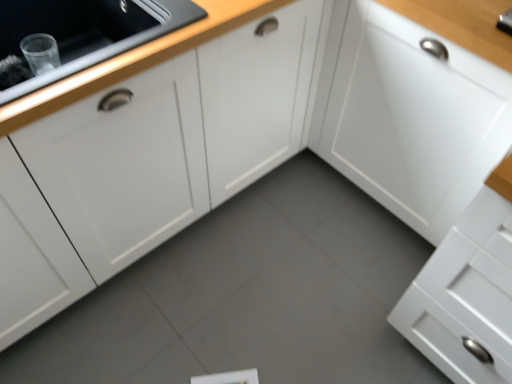
Question: Is white matte cabinet at left, the 2th cabinetry viewed from the right, to the left of white matte cabinet at upper right, which ranks as the first cabinetry in right-to-left order, from the viewer's perspective?

Choices:
 (A) yes
 (B) no

Answer: (A)

Question: Can you confirm if white matte cabinet at left, the 2th cabinetry viewed from the right, is shorter than white matte cabinet at upper right, the second cabinetry in the left-to-right sequence?

Choices:
 (A) yes
 (B) no

Answer: (A)

Question: Is white matte cabinet at left, which is the first cabinetry in left-to-right order, directly adjacent to white matte cabinet at upper right, which ranks as the first cabinetry in right-to-left order?

Choices:
 (A) no
 (B) yes

Answer: (A)

Question: Is the position of white matte cabinet at left, which is the first cabinetry in left-to-right order, more distant than that of white matte cabinet at upper right, which ranks as the first cabinetry in right-to-left order?

Choices:
 (A) no
 (B) yes

Answer: (A)

Question: Considering the relative sizes of white matte cabinet at left, the 2th cabinetry viewed from the right, and white matte cabinet at upper right, the second cabinetry in the left-to-right sequence, in the image provided, is white matte cabinet at left, the 2th cabinetry viewed from the right, smaller than white matte cabinet at upper right, the second cabinetry in the left-to-right sequence,?

Choices:
 (A) yes
 (B) no

Answer: (A)

Question: From the image's perspective, does white matte cabinet at left, the 2th cabinetry viewed from the right, appear higher than white matte cabinet at upper right, the second cabinetry in the left-to-right sequence?

Choices:
 (A) no
 (B) yes

Answer: (B)

Question: From a real-world perspective, does white matte cabinet at upper right, the second cabinetry in the left-to-right sequence, sit lower than white matte cabinet at left, the 2th cabinetry viewed from the right?

Choices:
 (A) no
 (B) yes

Answer: (B)

Question: Would you consider white matte cabinet at upper right, the second cabinetry in the left-to-right sequence, to be distant from white matte cabinet at left, which is the first cabinetry in left-to-right order?

Choices:
 (A) yes
 (B) no

Answer: (B)

Question: Is white matte cabinet at upper right, the second cabinetry in the left-to-right sequence, positioned in front of white matte cabinet at left, which is the first cabinetry in left-to-right order?

Choices:
 (A) no
 (B) yes

Answer: (A)

Question: From the image's perspective, does white matte cabinet at upper right, the second cabinetry in the left-to-right sequence, appear higher than white matte cabinet at left, the 2th cabinetry viewed from the right?

Choices:
 (A) no
 (B) yes

Answer: (A)

Question: Is white matte cabinet at upper right, the second cabinetry in the left-to-right sequence, taller than white matte cabinet at left, the 2th cabinetry viewed from the right?

Choices:
 (A) yes
 (B) no

Answer: (A)

Question: Can you confirm if white matte cabinet at upper right, the second cabinetry in the left-to-right sequence, is positioned to the left of white matte cabinet at left, which is the first cabinetry in left-to-right order?

Choices:
 (A) yes
 (B) no

Answer: (B)

Question: From the image's perspective, is white matte cabinet at upper right, the second cabinetry in the left-to-right sequence, located above or below white matte cabinet at left, which is the first cabinetry in left-to-right order?

Choices:
 (A) above
 (B) below

Answer: (B)